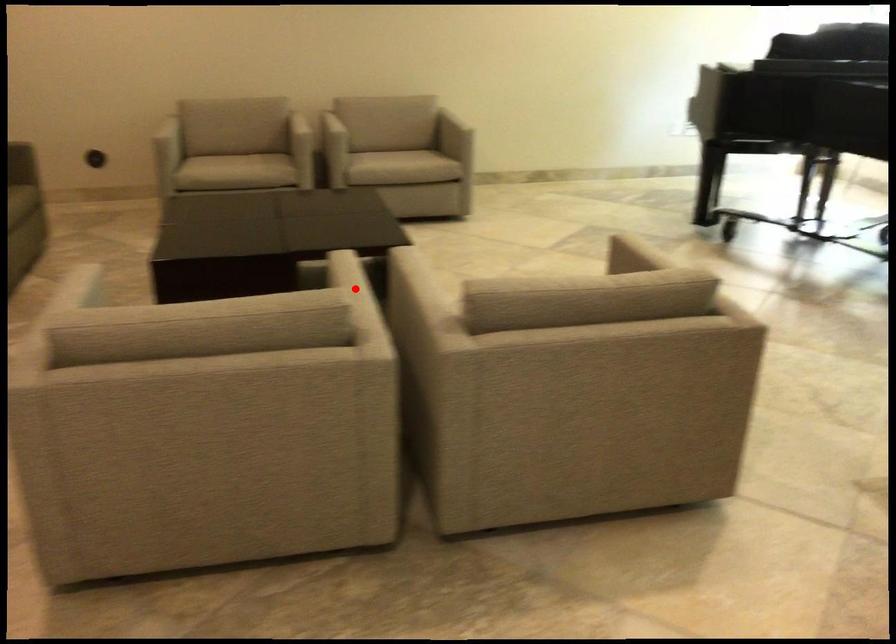
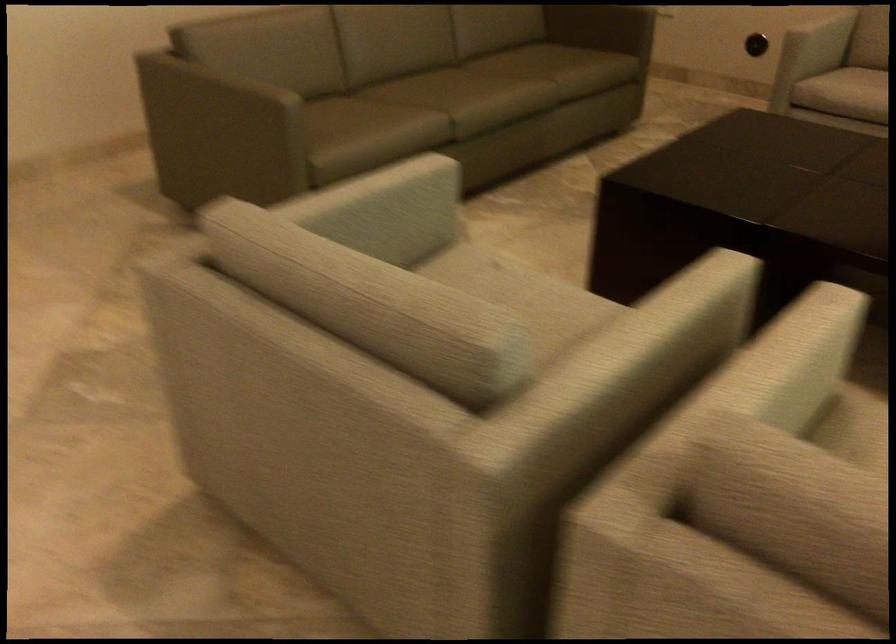
In the second image, find the point that corresponds to the highlighted location in the first image.

(659, 332)